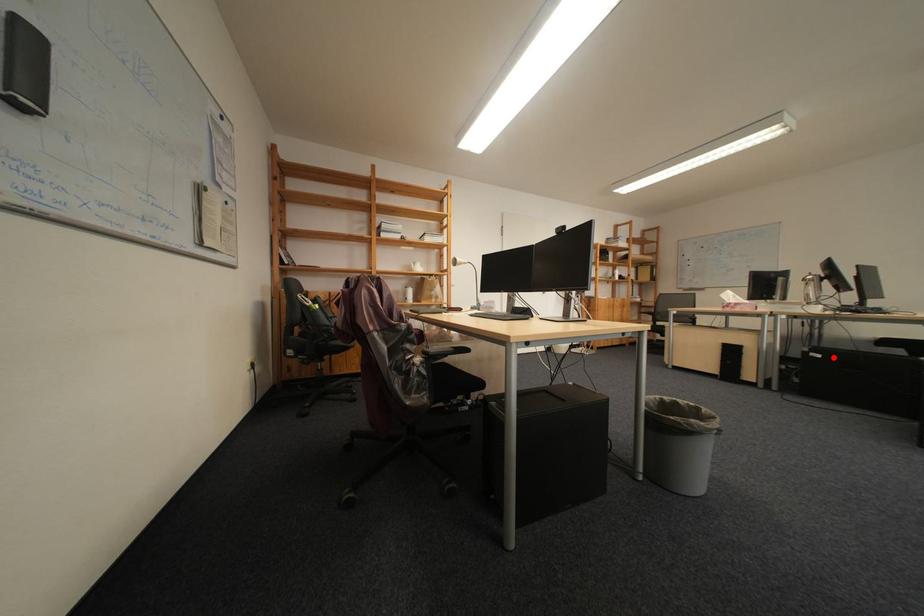
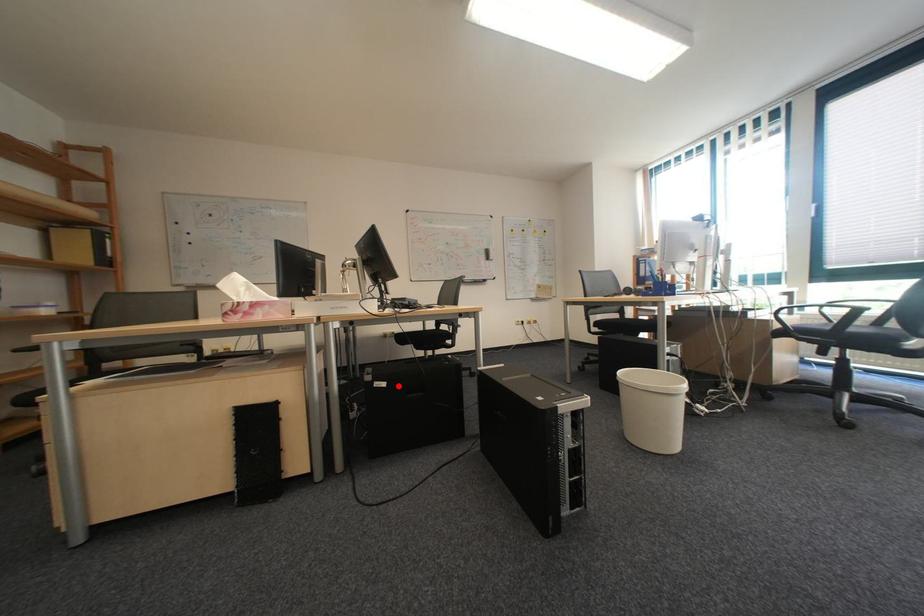
I am providing you with two images of the same scene from different viewpoints. A red point is marked on the first image and another point is marked on the second image. Is the red point in image1 aligned with the point shown in image2?

Yes